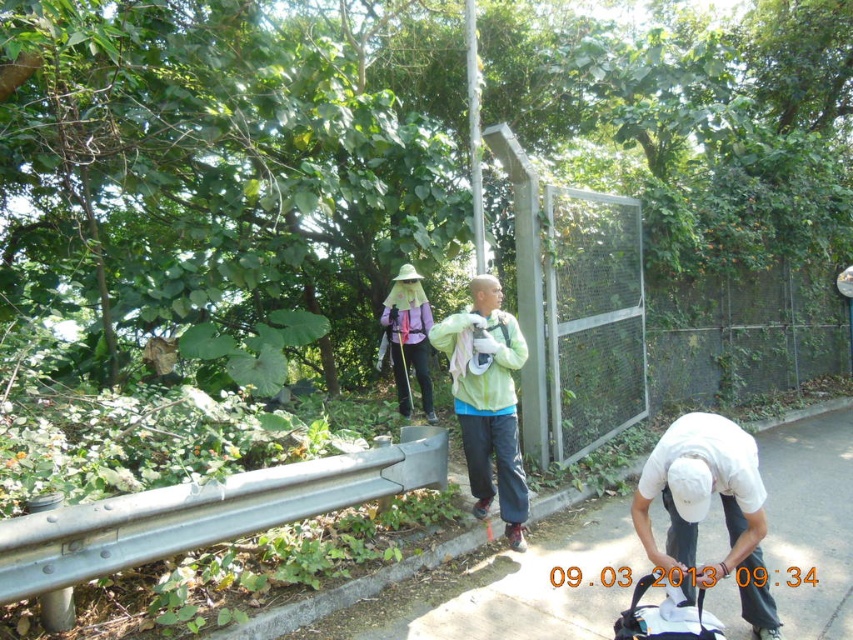
You are standing at the roadside and see two points marked in the image. Which point is closer to you, point (291, 637) or point (619, 627)?

Point (291, 637) is closer to you because it is further to the viewer than point (619, 627).

You are a photographer trying to capture a group photo of the green matte jacket at center and the purple matte backpack at center. Since you want both subjects to be clearly visible, which object should you ensure is positioned closer to the camera to avoid being obscured?

The green matte jacket at center should be positioned closer to the camera because it occupies less space than the purple matte backpack at center, making it easier to ensure visibility without obstruction.

You are a pedestrian standing at the edge of the sidewalk and see the white matte shirt at lower right and the green matte jacket at center. Which object is closer to you?

The white matte shirt at lower right is closer to you because it is positioned under the green matte jacket at center, indicating it is in a lower, more forward position.